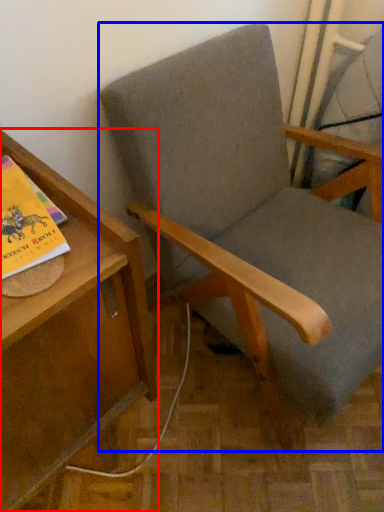
Question: Which of the following is the farthest to the observer, table (highlighted by a red box) or chair (highlighted by a blue box)?

Choices:
 (A) table
 (B) chair

Answer: (B)